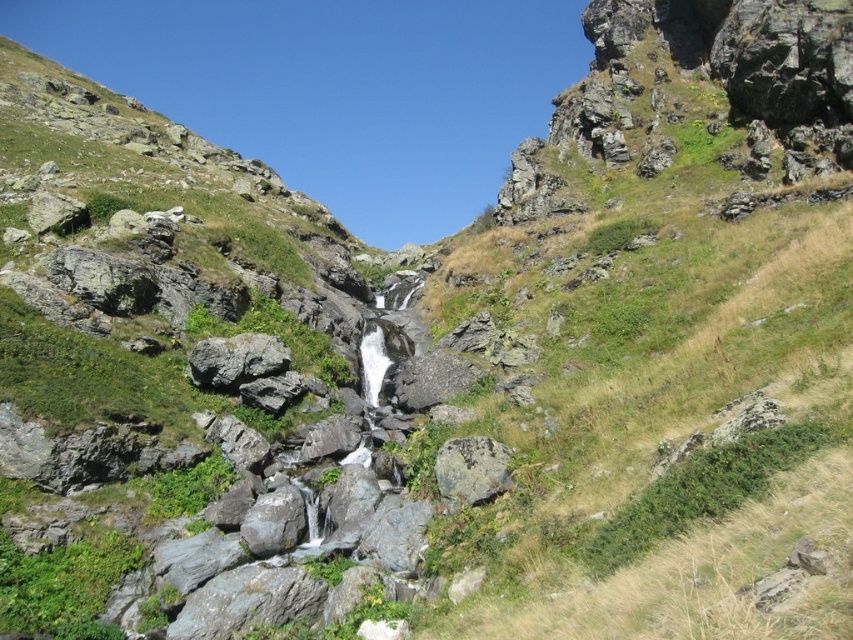
Is gray rough rock at center thinner than rusty metallic rock at center?

No, gray rough rock at center is not thinner than rusty metallic rock at center.

Does gray rough rock at center lie behind rusty metallic rock at center?

Yes.

What do you see at coordinates (235, 358) in the screenshot?
I see `gray rough rock at center` at bounding box center [235, 358].

Where is `gray rough rock at center`? gray rough rock at center is located at coordinates (235, 358).